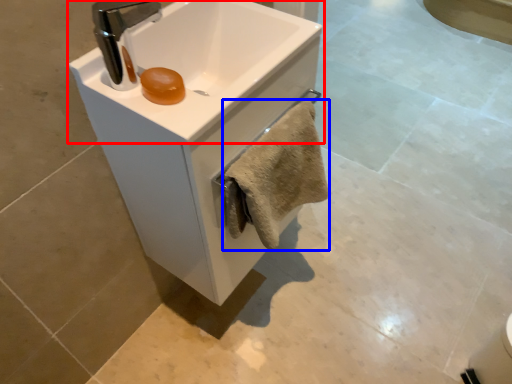
Question: Which point is closer to the camera, sink (highlighted by a red box) or bath towel (highlighted by a blue box)?

Choices:
 (A) sink
 (B) bath towel

Answer: (A)